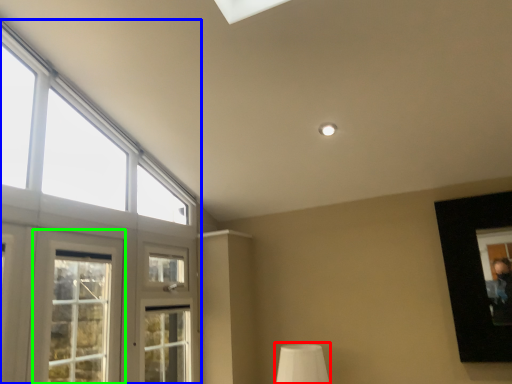
Question: Considering the real-world distances, which object is closest to table lamp (highlighted by a red box)? window (highlighted by a blue box) or window (highlighted by a green box).

Choices:
 (A) window
 (B) window

Answer: (A)